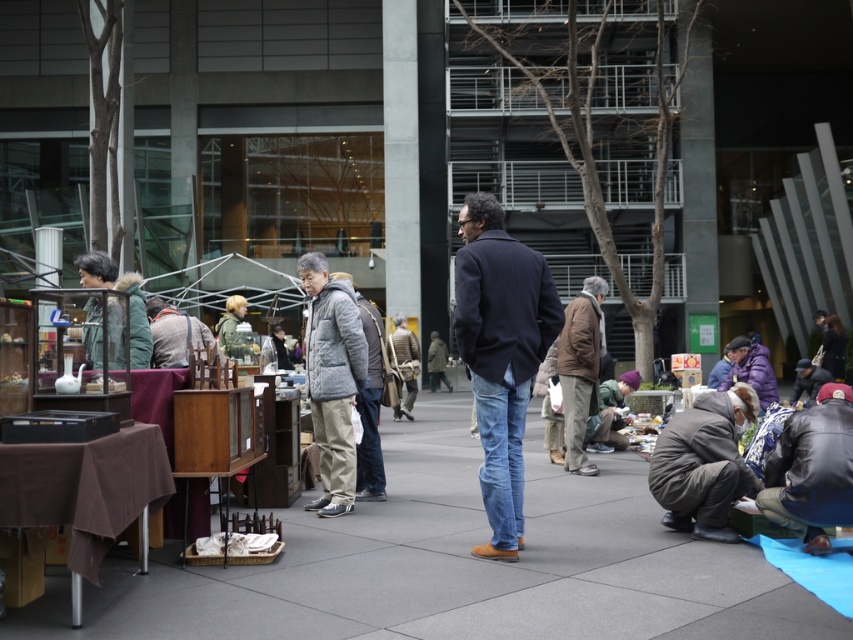
You are a delivery person who needs to place a heavy box on the ground. You see the smooth concrete pavement at center and the purple fuzzy jacket at lower right. Which surface is more suitable for placing the box?

The smooth concrete pavement at center is more suitable because it is a stable surface, whereas the purple fuzzy jacket at lower right is an object that is likely being worn or displayed and not meant for placing heavy items.

You are a customer at the flea market and want to pick up both the dark blue wool coat at center and the purple fuzzy jacket at lower right. Which item should you approach first to reach the one closer to you?

The dark blue wool coat at center is closer to the viewer than the purple fuzzy jacket at lower right, so you should approach the dark blue wool coat at center first.